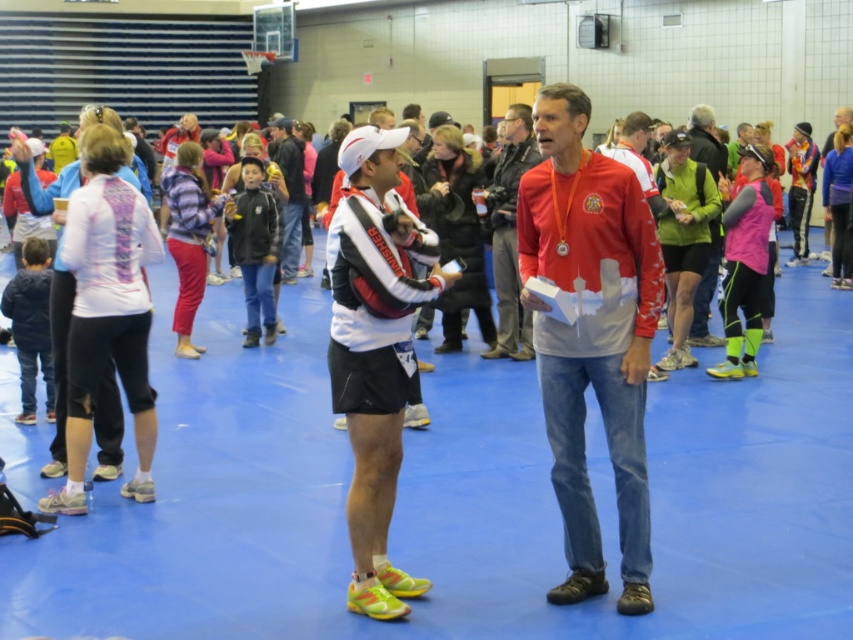
Question: In this image, where is matte red shirt at center located relative to dark blue jeans at center?

Choices:
 (A) left
 (B) right

Answer: (B)

Question: Which point is farther to the camera?

Choices:
 (A) (517, 269)
 (B) (288, 260)
 (C) (560, 134)
 (D) (689, 148)

Answer: (B)

Question: Does matte red shirt at center appear under dark blue jeans at center?

Choices:
 (A) no
 (B) yes

Answer: (B)

Question: Does matte red shirt at center appear on the left side of pink fabric at center?

Choices:
 (A) no
 (B) yes

Answer: (B)

Question: Based on their relative distances, which object is farther from the matte red shirt at center?

Choices:
 (A) pink fabric at center
 (B) dark blue jeans at center
 (C) red matte jacket at center

Answer: (B)

Question: Which of these objects is positioned closest to the dark blue jeans at center?

Choices:
 (A) matte red shirt at center
 (B) pink fabric at center
 (C) red matte jacket at center

Answer: (C)